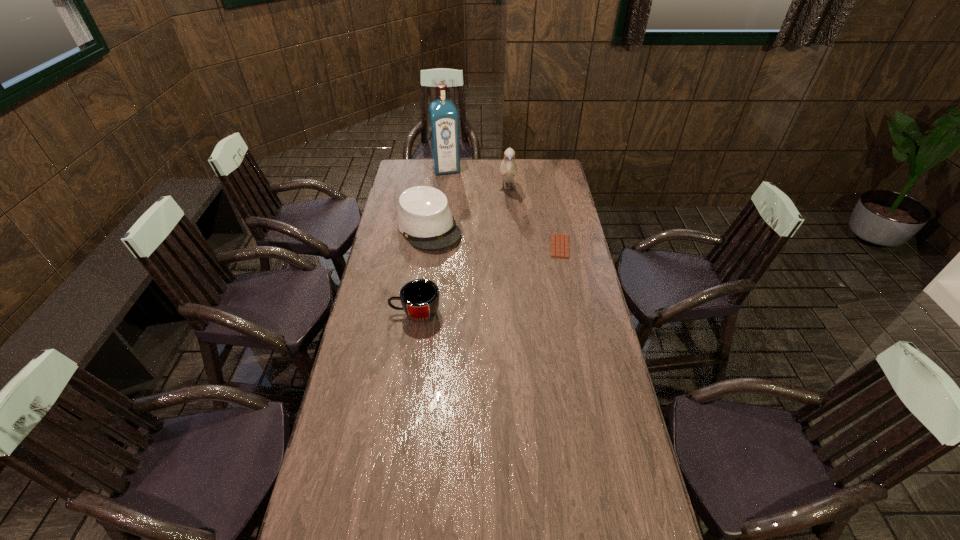
I want to click on vacant space on the desktop that is between the nearest object and the candy bar and is positioned on the flat label side of the farthest object, so (x=481, y=283).

Where is `vacant spot on the desktop that is between the nearest object and the shortest object and is positioned at the beak of the second object from right to left`? vacant spot on the desktop that is between the nearest object and the shortest object and is positioned at the beak of the second object from right to left is located at coordinates (512, 269).

You are a GUI agent. You are given a task and a screenshot of the screen. Output one action in this format:
    pyautogui.click(x=<x>, y=<y>)
    Task: Click on the vacant space on the desktop that is between the nearest object and the shortest object and is positioned on the front-facing side of the hat
    This screenshot has height=540, width=960.
    Given the screenshot: What is the action you would take?
    pyautogui.click(x=473, y=286)